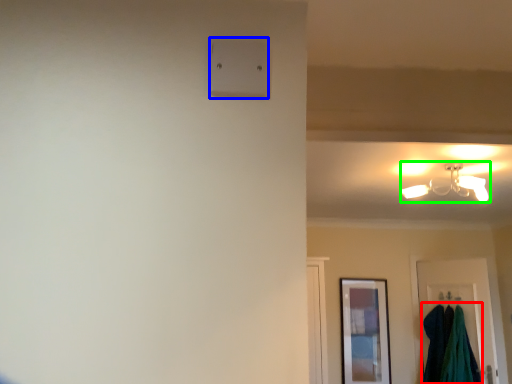
Question: Estimate the real-world distances between objects in this image. Which object is farther from laundry (highlighted by a red box), light switch (highlighted by a blue box) or lamp (highlighted by a green box)?

Choices:
 (A) light switch
 (B) lamp

Answer: (A)